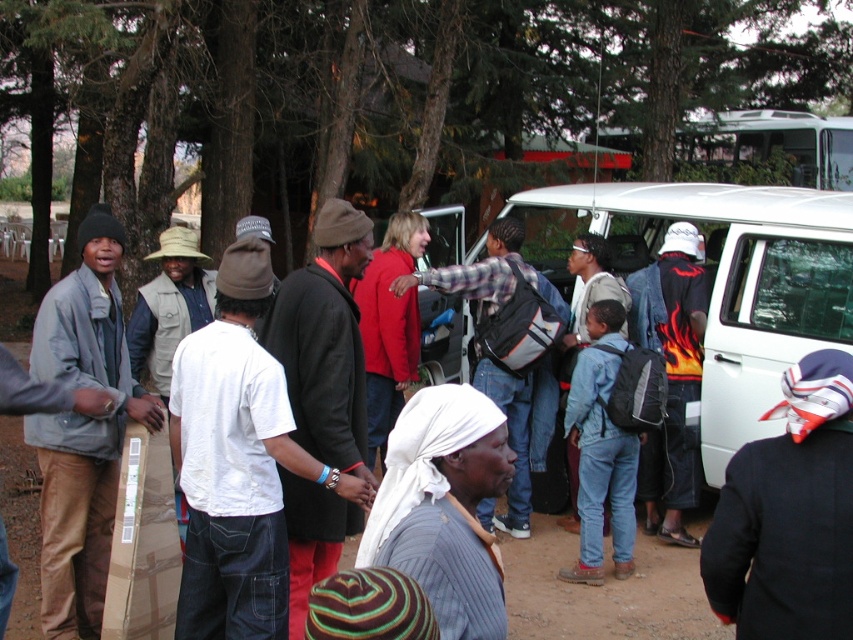
Question: Estimate the real-world distances between objects in this image. Which object is closer to the denim jeans at center?

Choices:
 (A) black leather jacket at center
 (B) matte gray jacket at left

Answer: (A)

Question: From the image, what is the correct spatial relationship of matte gray jacket at left in relation to black leather jacket at center?

Choices:
 (A) right
 (B) left

Answer: (B)

Question: Which point appears closest to the camera in this image?

Choices:
 (A) (601, 264)
 (B) (660, 257)

Answer: (A)

Question: Does plaid fabric shirt at center appear on the right side of denim jeans at center?

Choices:
 (A) yes
 (B) no

Answer: (B)

Question: Estimate the real-world distances between objects in this image. Which object is closer to the denim jeans at center?

Choices:
 (A) matte gray jacket at left
 (B) flame-patterned shirt at center-right
 (C) plaid fabric shirt at center
 (D) white matte van at center

Answer: (C)

Question: Considering the relative positions of white matte van at center and denim jeans at center in the image provided, where is white matte van at center located with respect to denim jeans at center?

Choices:
 (A) right
 (B) left

Answer: (A)